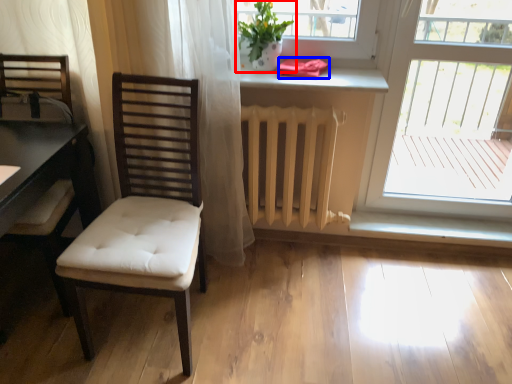
Question: Among these objects, which one is nearest to the camera, houseplant (highlighted by a red box) or towel/napkin (highlighted by a blue box)?

Choices:
 (A) houseplant
 (B) towel/napkin

Answer: (A)